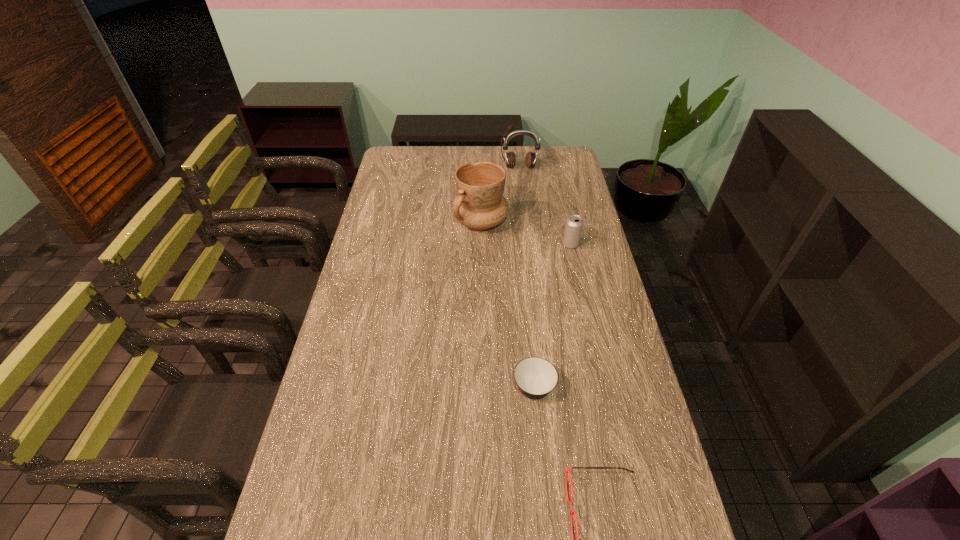
Identify which object is the fourth nearest to the soup bowl. Please provide its 2D coordinates. Your answer should be formatted as a tuple, i.e. [(x, y)], where the tuple contains the x and y coordinates of a point satisfying the conditions above.

[(510, 159)]

Locate an element on the screen. The height and width of the screenshot is (540, 960). free space that satisfies the following two spatial constraints: 1. on the back side of the fourth farthest object; 2. on the left side of the beer can is located at coordinates pyautogui.click(x=519, y=244).

The width and height of the screenshot is (960, 540). I want to click on free location that satisfies the following two spatial constraints: 1. on the back side of the beer can; 2. on the left side of the fourth farthest object, so click(x=519, y=244).